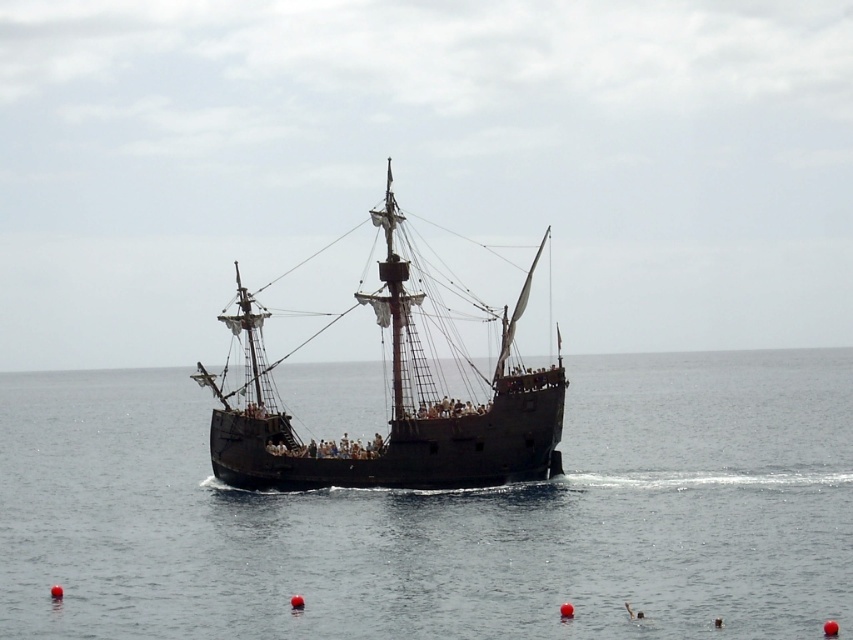
Question: Which object is farther from the camera taking this photo?

Choices:
 (A) black wooden pirate ship at center
 (B) black water at center

Answer: (A)

Question: Does black water at center appear on the right side of black wooden pirate ship at center?

Choices:
 (A) yes
 (B) no

Answer: (A)

Question: Which object appears farthest from the camera in this image?

Choices:
 (A) black wooden pirate ship at center
 (B) black water at center

Answer: (A)

Question: Can you confirm if black water at center is positioned below black wooden pirate ship at center?

Choices:
 (A) no
 (B) yes

Answer: (B)

Question: Which object is closer to the camera taking this photo?

Choices:
 (A) black water at center
 (B) black wooden pirate ship at center

Answer: (A)

Question: Does black water at center appear on the right side of black wooden pirate ship at center?

Choices:
 (A) yes
 (B) no

Answer: (A)